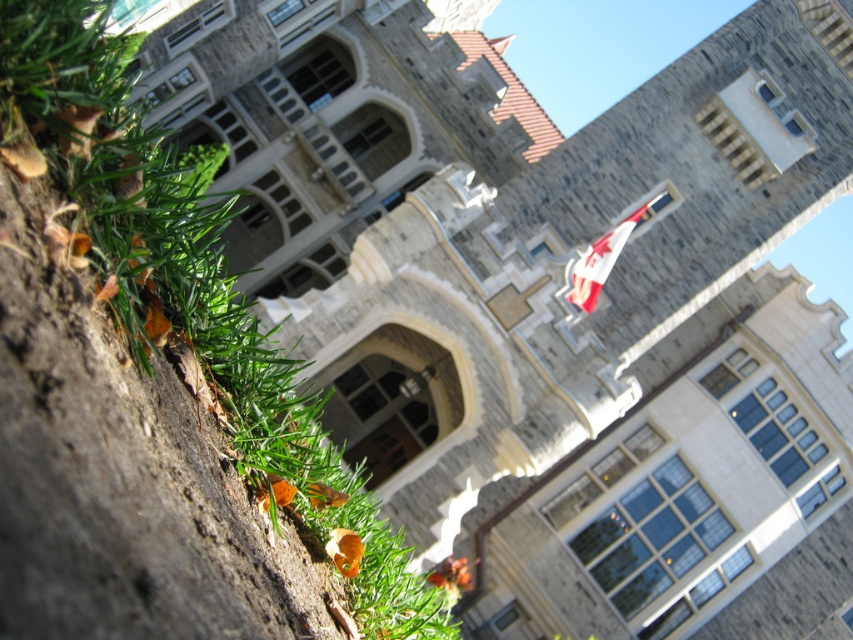
Question: Among these objects, which one is farthest from the camera?

Choices:
 (A) red fabric flag at upper center
 (B) green grass at lower left

Answer: (A)

Question: Which point is closer to the camera?

Choices:
 (A) green grass at lower left
 (B) red fabric flag at upper center

Answer: (A)

Question: Is the position of green grass at lower left less distant than that of red fabric flag at upper center?

Choices:
 (A) no
 (B) yes

Answer: (B)

Question: Is green grass at lower left behind red fabric flag at upper center?

Choices:
 (A) yes
 (B) no

Answer: (B)

Question: Where is green grass at lower left located in relation to red fabric flag at upper center in the image?

Choices:
 (A) left
 (B) right

Answer: (A)